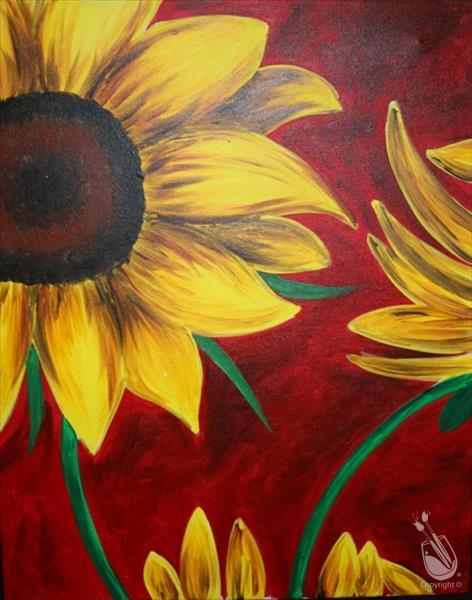
Image resolution: width=472 pixels, height=600 pixels. I want to click on painting, so click(x=323, y=422).